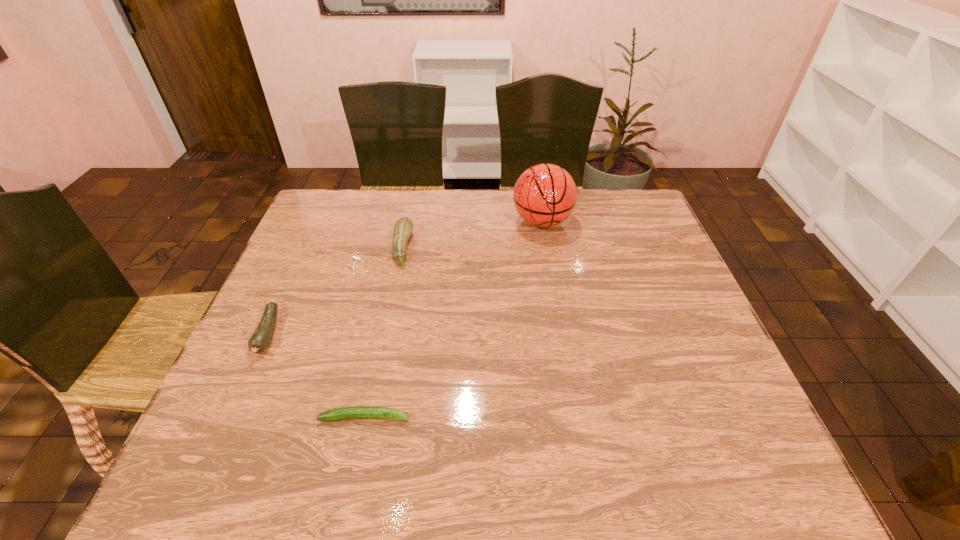
At what (x,y) coordinates should I click in order to perform the action: click on vacant point located between the shortest object and the rightmost object. Please return your answer as a coordinate pair (x, y). Looking at the image, I should click on (453, 319).

Locate an element on the screen. The image size is (960, 540). object that stands as the second closest to the rightmost object is located at coordinates (360, 412).

Locate which object is the third closest to the shortest zucchini. Please provide its 2D coordinates. Your answer should be formatted as a tuple, i.e. [(x, y)], where the tuple contains the x and y coordinates of a point satisfying the conditions above.

[(545, 195)]

At what (x,y) coordinates should I click in order to perform the action: click on zucchini that is the closest to the tallest zucchini. Please return your answer as a coordinate pair (x, y). This screenshot has height=540, width=960. Looking at the image, I should click on (262, 336).

Find the location of a particular element. zucchini that is the closest to the second nearest zucchini is located at coordinates (360, 412).

Locate an element on the screen. free location that satisfies the following two spatial constraints: 1. at the stem end of the tallest zucchini; 2. at the blossom end of the third farthest object is located at coordinates (385, 333).

The image size is (960, 540). In order to click on free space in the image that satisfies the following two spatial constraints: 1. at the stem end of the tallest zucchini; 2. at the blossom end of the second farthest zucchini in this screenshot , I will do `click(385, 333)`.

I want to click on free space that satisfies the following two spatial constraints: 1. on the side with spill of the tallest object; 2. on the front-facing side of the shortest object, so click(x=576, y=417).

Locate an element on the screen. vacant region that satisfies the following two spatial constraints: 1. at the stem end of the tallest zucchini; 2. at the blossom end of the leftmost object is located at coordinates (385, 333).

Locate an element on the screen. vacant region that satisfies the following two spatial constraints: 1. at the stem end of the third shortest object; 2. at the blossom end of the second shortest zucchini is located at coordinates (385, 333).